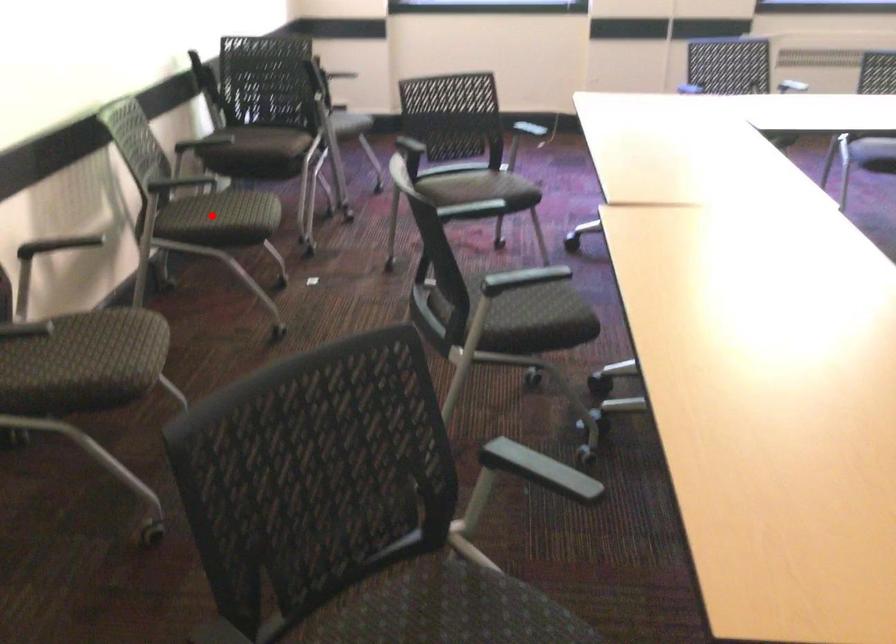
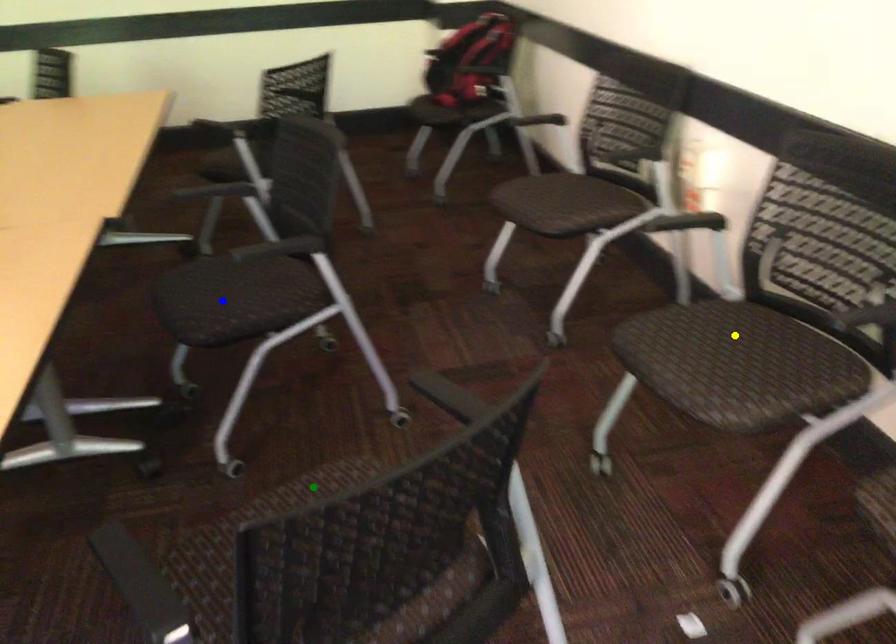
Question: I am providing you with two images of the same scene from different viewpoints. A red point is marked on the first image. You are given multiple points on the second image. Which mark in image 2 goes with the point in image 1?

Choices:
 (A) blue point
 (B) yellow point
 (C) green point

Answer: (B)